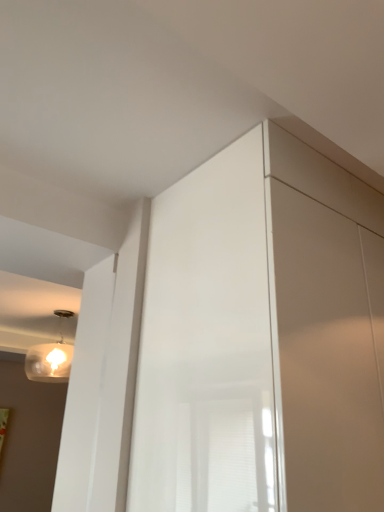
Question: Considering the relative sizes of glossy white screen door at center and matte glass lamp at upper left in the image provided, is glossy white screen door at center taller than matte glass lamp at upper left?

Choices:
 (A) no
 (B) yes

Answer: (B)

Question: From a real-world perspective, is glossy white screen door at center located beneath matte glass lamp at upper left?

Choices:
 (A) no
 (B) yes

Answer: (B)

Question: From the image's perspective, is glossy white screen door at center below matte glass lamp at upper left?

Choices:
 (A) no
 (B) yes

Answer: (A)

Question: Considering the relative sizes of glossy white screen door at center and matte glass lamp at upper left in the image provided, is glossy white screen door at center bigger than matte glass lamp at upper left?

Choices:
 (A) no
 (B) yes

Answer: (B)

Question: From a real-world perspective, is glossy white screen door at center positioned over matte glass lamp at upper left based on gravity?

Choices:
 (A) yes
 (B) no

Answer: (B)

Question: Is glossy white screen door at center wider than matte glass lamp at upper left?

Choices:
 (A) yes
 (B) no

Answer: (A)

Question: Does matte glass lamp at upper left appear on the left side of glossy white screen door at center?

Choices:
 (A) yes
 (B) no

Answer: (A)

Question: Are matte glass lamp at upper left and glossy white screen door at center making contact?

Choices:
 (A) no
 (B) yes

Answer: (A)

Question: Is matte glass lamp at upper left smaller than glossy white screen door at center?

Choices:
 (A) no
 (B) yes

Answer: (B)

Question: From the image's perspective, is matte glass lamp at upper left located above glossy white screen door at center?

Choices:
 (A) no
 (B) yes

Answer: (A)

Question: From a real-world perspective, is matte glass lamp at upper left positioned under glossy white screen door at center based on gravity?

Choices:
 (A) no
 (B) yes

Answer: (A)

Question: Is glossy white screen door at center inside matte glass lamp at upper left?

Choices:
 (A) no
 (B) yes

Answer: (A)

Question: Based on their sizes in the image, would you say matte glass lamp at upper left is bigger or smaller than glossy white screen door at center?

Choices:
 (A) small
 (B) big

Answer: (A)